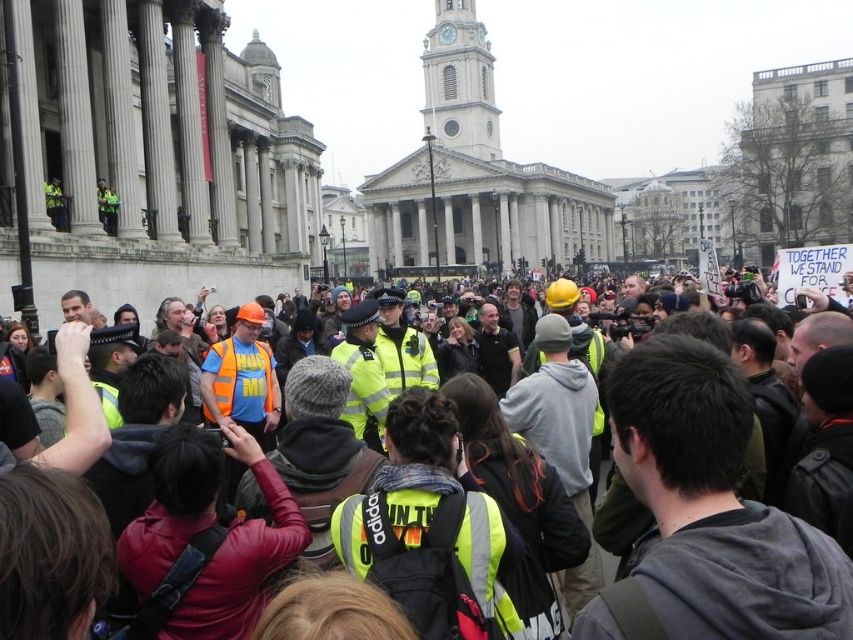
Question: Does yellow reflective vests at center appear over reflective orange safety vest at center?

Choices:
 (A) yes
 (B) no

Answer: (B)

Question: Which point is farther to the camera?

Choices:
 (A) (491, 556)
 (B) (265, 392)
 (C) (732, 529)

Answer: (B)

Question: Among these points, which one is nearest to the camera?

Choices:
 (A) (426, 496)
 (B) (225, 376)

Answer: (A)

Question: Which point is farther to the camera?

Choices:
 (A) (341, 524)
 (B) (225, 413)
 (C) (838, 593)

Answer: (B)

Question: Is neon yellow safety vest at center to the right of reflective orange safety vest at center from the viewer's perspective?

Choices:
 (A) no
 (B) yes

Answer: (B)

Question: Can you confirm if yellow reflective vests at center is bigger than neon yellow safety vest at center?

Choices:
 (A) yes
 (B) no

Answer: (A)